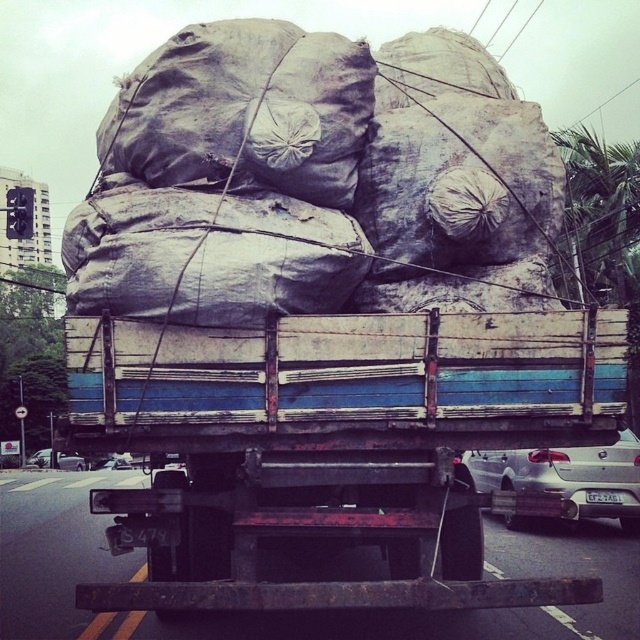
You are a traffic officer observing a scene where a rusty metal trailer truck at center is parked next to a silver metallic sedan at lower left. Which vehicle takes up more space horizontally?

The silver metallic sedan at lower left takes up more space horizontally since the rusty metal trailer truck at center has a smaller width according to the description.

You are a traffic officer observing a road with a rusty metal trailer truck at center and a silver metallic car at lower right. The road has a width restriction of 2.5 meters. Can both vehicles pass side by side without overlapping?

The rusty metal trailer truck at center might be wider than silver metallic car at lower right, so there is a possibility that the combined width exceeds the 2.5 meters restriction. They might not be able to pass side by side safely.